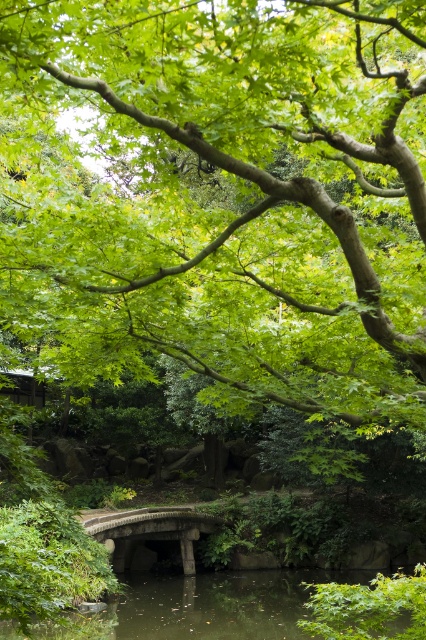
You are a hiker who wants to cross the stone bridge at center to reach the other side. However, you notice the green liquid water at center is higher than the bridge. Is the bridge still passable?

The green liquid water at center is taller than the stone bridge at center, which means the water has risen above the bridge. Therefore, the bridge is submerged and not passable.

You are planning to cross the stone bridge at center over the green liquid water at center. Considering their widths, which one is wider?

The green liquid water at center is wider than the stone bridge at center, so the water is wider.